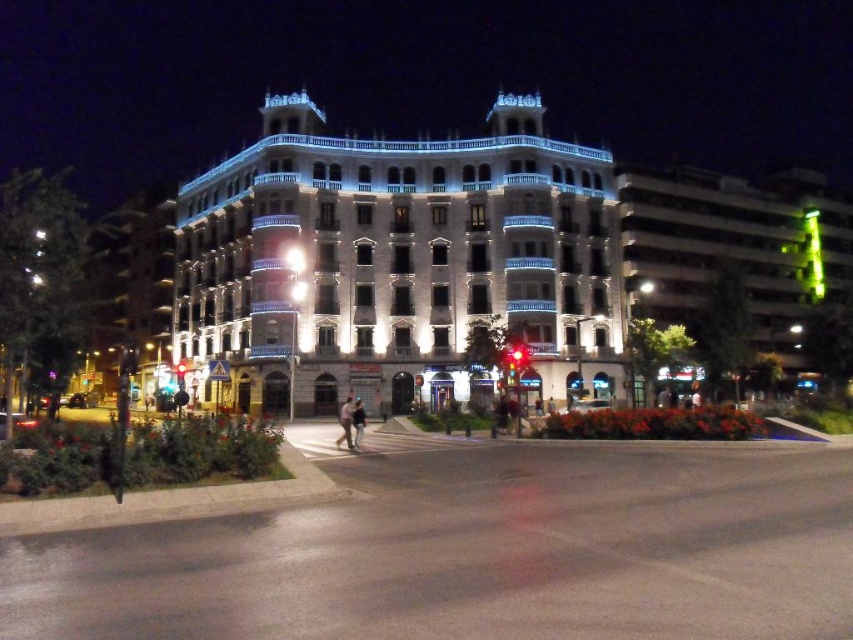
Question: Is white glossy building at center below brown leather jacket at center?

Choices:
 (A) no
 (B) yes

Answer: (A)

Question: Which point is closer to the camera?

Choices:
 (A) white glossy building at center
 (B) brown leather jacket at center

Answer: (B)

Question: Which of the following is the closest to the observer?

Choices:
 (A) brown leather jacket at center
 (B) white glossy building at center

Answer: (A)

Question: Is white glossy building at center to the right of brown leather jacket at center from the viewer's perspective?

Choices:
 (A) yes
 (B) no

Answer: (B)

Question: Is white glossy building at center behind brown leather jacket at center?

Choices:
 (A) yes
 (B) no

Answer: (A)